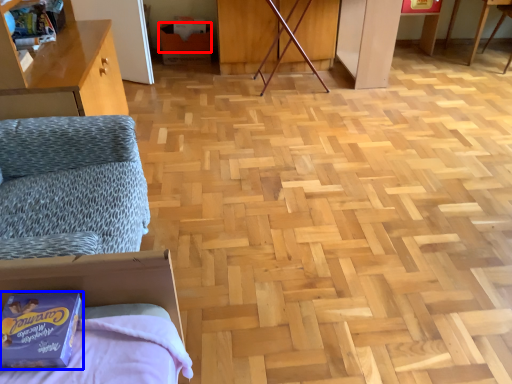
Question: Which point is closer to the camera, cardboard box (highlighted by a red box) or package (highlighted by a blue box)?

Choices:
 (A) cardboard box
 (B) package

Answer: (B)